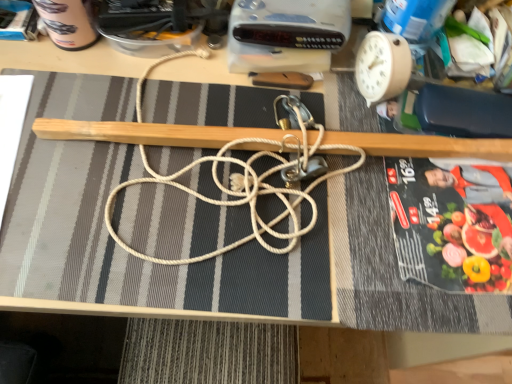
Question: Would you say beige plastic clock at upper right is part of white rope at center's contents?

Choices:
 (A) no
 (B) yes

Answer: (A)

Question: Does white rope at center have a greater height compared to beige plastic clock at upper right?

Choices:
 (A) yes
 (B) no

Answer: (B)

Question: Considering the relative sizes of white rope at center and beige plastic clock at upper right in the image provided, is white rope at center thinner than beige plastic clock at upper right?

Choices:
 (A) no
 (B) yes

Answer: (A)

Question: Does white rope at center come behind beige plastic clock at upper right?

Choices:
 (A) yes
 (B) no

Answer: (B)

Question: From a real-world perspective, does white rope at center sit lower than beige plastic clock at upper right?

Choices:
 (A) no
 (B) yes

Answer: (B)

Question: Choose the correct answer: Is white rope at center inside black glossy paperback book at right, the 1th paperback book viewed from the front, or outside it?

Choices:
 (A) inside
 (B) outside

Answer: (B)

Question: In terms of size, does white rope at center appear bigger or smaller than black glossy paperback book at right, arranged as the 2th paperback book when viewed from the top?

Choices:
 (A) big
 (B) small

Answer: (A)

Question: Considering the positions of white rope at center and black glossy paperback book at right, arranged as the 2th paperback book when viewed from the top, in the image, is white rope at center taller or shorter than black glossy paperback book at right, arranged as the 2th paperback book when viewed from the top,?

Choices:
 (A) tall
 (B) short

Answer: (B)

Question: Considering the positions of white rope at center and black glossy paperback book at right, arranged as the 2th paperback book when viewed from the top, in the image, is white rope at center wider or thinner than black glossy paperback book at right, arranged as the 2th paperback book when viewed from the top,?

Choices:
 (A) thin
 (B) wide

Answer: (B)

Question: In terms of height, does black glossy paperback book at right, arranged as the 2th paperback book when viewed from the top, look taller or shorter compared to beige plastic clock at upper right?

Choices:
 (A) short
 (B) tall

Answer: (A)

Question: From a real-world perspective, relative to beige plastic clock at upper right, is black glossy paperback book at right, which is counted as the first paperback book, starting from the bottom, vertically above or below?

Choices:
 (A) below
 (B) above

Answer: (A)

Question: In the image, is black glossy paperback book at right, which is counted as the 1th paperback book, starting from the right, positioned in front of or behind beige plastic clock at upper right?

Choices:
 (A) behind
 (B) front

Answer: (B)

Question: In terms of width, does black glossy paperback book at right, which is counted as the first paperback book, starting from the bottom, look wider or thinner when compared to beige plastic clock at upper right?

Choices:
 (A) wide
 (B) thin

Answer: (A)

Question: Is matte black paperback book at upper left, which is the 2th paperback book from bottom to top, inside or outside of white rope at center?

Choices:
 (A) inside
 (B) outside

Answer: (B)

Question: Considering the positions of matte black paperback book at upper left, marked as the 1th paperback book in a top-to-bottom arrangement, and white rope at center in the image, is matte black paperback book at upper left, marked as the 1th paperback book in a top-to-bottom arrangement, taller or shorter than white rope at center?

Choices:
 (A) tall
 (B) short

Answer: (A)